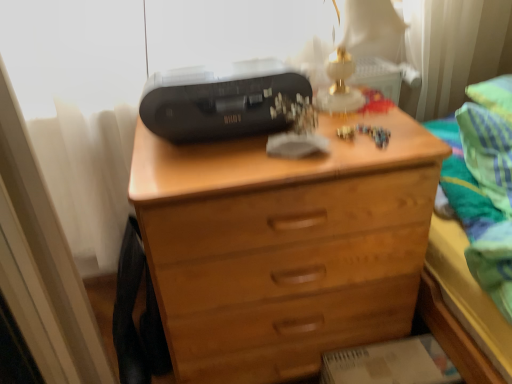
The width and height of the screenshot is (512, 384). What do you see at coordinates (481, 209) in the screenshot?
I see `green striped fabric at upper right` at bounding box center [481, 209].

This screenshot has height=384, width=512. Find the location of `green striped fabric at upper right`. green striped fabric at upper right is located at coordinates (481, 209).

This screenshot has width=512, height=384. I want to click on green striped fabric at upper right, so click(x=481, y=209).

Is black plastic printer at upper center turned away from green striped fabric at upper right?

No, black plastic printer at upper center's orientation is not away from green striped fabric at upper right.

Is black plastic printer at upper center inside or outside of green striped fabric at upper right?

black plastic printer at upper center cannot be found inside green striped fabric at upper right.

Is black plastic printer at upper center wider than green striped fabric at upper right?

No, black plastic printer at upper center is not wider than green striped fabric at upper right.

From a real-world perspective, which object rests below the other?

green striped fabric at upper right, from a real-world perspective.

From a real-world perspective, is green striped fabric at upper right under black plastic printer at upper center?

Yes, from a real-world perspective, green striped fabric at upper right is beneath black plastic printer at upper center.

Which object is positioned more to the left, green striped fabric at upper right or black plastic printer at upper center?

black plastic printer at upper center is more to the left.

In terms of height, does green striped fabric at upper right look taller or shorter compared to black plastic printer at upper center?

Clearly, green striped fabric at upper right is taller compared to black plastic printer at upper center.

In the scene shown: How many degrees apart are the facing directions of green striped fabric at upper right and black plastic printer at upper center?

The facing directions of green striped fabric at upper right and black plastic printer at upper center are 10.9 degrees apart.

Who is shorter, black plastic printer at upper center or wooden chest of drawers at center?

With less height is black plastic printer at upper center.

Is black plastic printer at upper center beside wooden chest of drawers at center?

No, black plastic printer at upper center is not with wooden chest of drawers at center.

Based on the photo, is black plastic printer at upper center inside or outside of wooden chest of drawers at center?

black plastic printer at upper center is not enclosed by wooden chest of drawers at center.

Is wooden chest of drawers at center thinner than green striped fabric at upper right?

In fact, wooden chest of drawers at center might be wider than green striped fabric at upper right.

Which is in front, wooden chest of drawers at center or green striped fabric at upper right?

wooden chest of drawers at center.

In the scene shown: Is wooden chest of drawers at center turned away from green striped fabric at upper right?

No, green striped fabric at upper right is not at the back of wooden chest of drawers at center.

Who is taller, wooden chest of drawers at center or green striped fabric at upper right?

Standing taller between the two is wooden chest of drawers at center.

Is green striped fabric at upper right oriented away from wooden chest of drawers at center?

No, green striped fabric at upper right's orientation is not away from wooden chest of drawers at center.

From a real-world perspective, which object rests below the other?

wooden chest of drawers at center.

Between green striped fabric at upper right and wooden chest of drawers at center, which one is positioned in front?

wooden chest of drawers at center is in front.

Which of these two, green striped fabric at upper right or wooden chest of drawers at center, is thinner?

Thinner between the two is green striped fabric at upper right.

Which of these two, wooden chest of drawers at center or black plastic printer at upper center, stands taller?

wooden chest of drawers at center is taller.

Is wooden chest of drawers at center looking in the opposite direction of black plastic printer at upper center?

No.

You are a GUI agent. You are given a task and a screenshot of the screen. Output one action in this format:
    pyautogui.click(x=<x>, y=<y>)
    Task: Click on the chest of drawers directly beneath the black plastic printer at upper center (from a real-world perspective)
    This screenshot has height=384, width=512.
    Given the screenshot: What is the action you would take?
    pyautogui.click(x=284, y=246)

At what (x,y) coordinates should I click in order to perform the action: click on printer above the green striped fabric at upper right (from the image's perspective). Please return your answer as a coordinate pair (x, y). Looking at the image, I should click on (220, 100).

Image resolution: width=512 pixels, height=384 pixels. Identify the location of bed that is below the black plastic printer at upper center (from the image's perspective). (481, 209).

When comparing their distances from wooden chest of drawers at center, does green striped fabric at upper right or black plastic printer at upper center seem closer?

The object closer to wooden chest of drawers at center is black plastic printer at upper center.

Looking at the image, which one is located closer to black plastic printer at upper center, green striped fabric at upper right or wooden chest of drawers at center?

wooden chest of drawers at center is positioned closer to the anchor black plastic printer at upper center.

From the picture: Based on their spatial positions, is wooden chest of drawers at center or black plastic printer at upper center closer to green striped fabric at upper right?

wooden chest of drawers at center is closer to green striped fabric at upper right.

In the scene shown: When comparing their distances from wooden chest of drawers at center, does black plastic printer at upper center or green striped fabric at upper right seem closer?

Among the two, black plastic printer at upper center is located nearer to wooden chest of drawers at center.

Considering their positions, is black plastic printer at upper center positioned closer to green striped fabric at upper right than wooden chest of drawers at center?

wooden chest of drawers at center lies closer to green striped fabric at upper right than the other object.

When comparing their distances from black plastic printer at upper center, does wooden chest of drawers at center or green striped fabric at upper right seem closer?

The object closer to black plastic printer at upper center is wooden chest of drawers at center.

At what (x,y) coordinates should I click in order to perform the action: click on chest of drawers between black plastic printer at upper center and green striped fabric at upper right from left to right. Please return your answer as a coordinate pair (x, y). The width and height of the screenshot is (512, 384). Looking at the image, I should click on (284, 246).